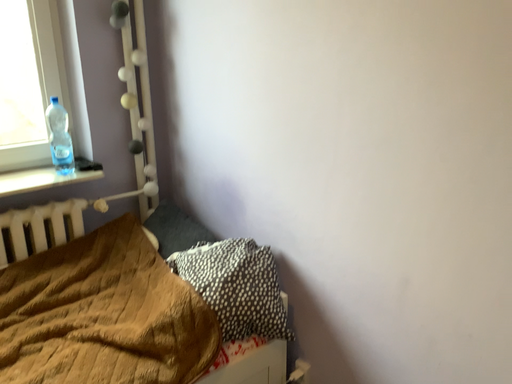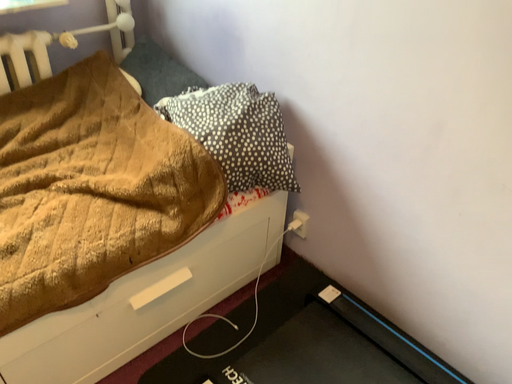
Question: Which way did the camera rotate in the video?

Choices:
 (A) rotated upward
 (B) rotated downward

Answer: (B)